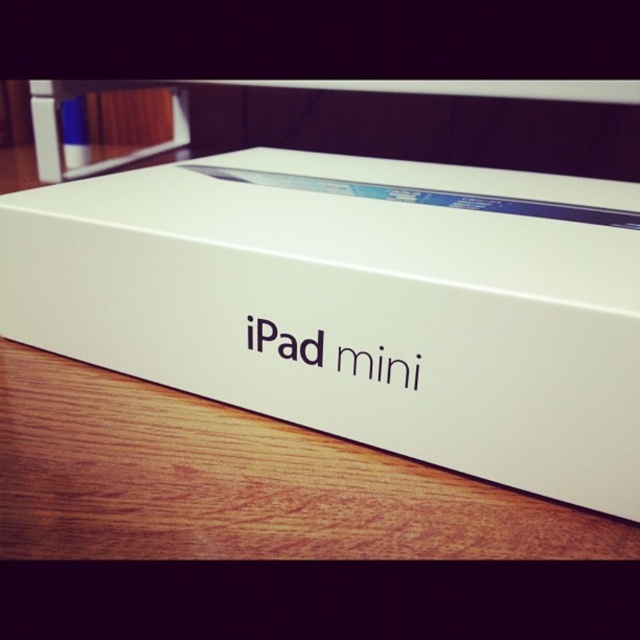
Question: Does white matte ipad mini at center have a smaller size compared to wooden table at lower center?

Choices:
 (A) yes
 (B) no

Answer: (B)

Question: In this image, where is white matte ipad mini at center located relative to wooden table at lower center?

Choices:
 (A) right
 (B) left

Answer: (A)

Question: Among these points, which one is farthest from the camera?

Choices:
 (A) (144, 451)
 (B) (232, 321)

Answer: (B)

Question: Is white matte ipad mini at center further to camera compared to wooden table at lower center?

Choices:
 (A) no
 (B) yes

Answer: (A)

Question: Among these points, which one is nearest to the camera?

Choices:
 (A) (621, 228)
 (B) (204, 460)

Answer: (B)

Question: Which of the following is the farthest from the observer?

Choices:
 (A) white matte ipad mini at center
 (B) wooden table at lower center

Answer: (B)